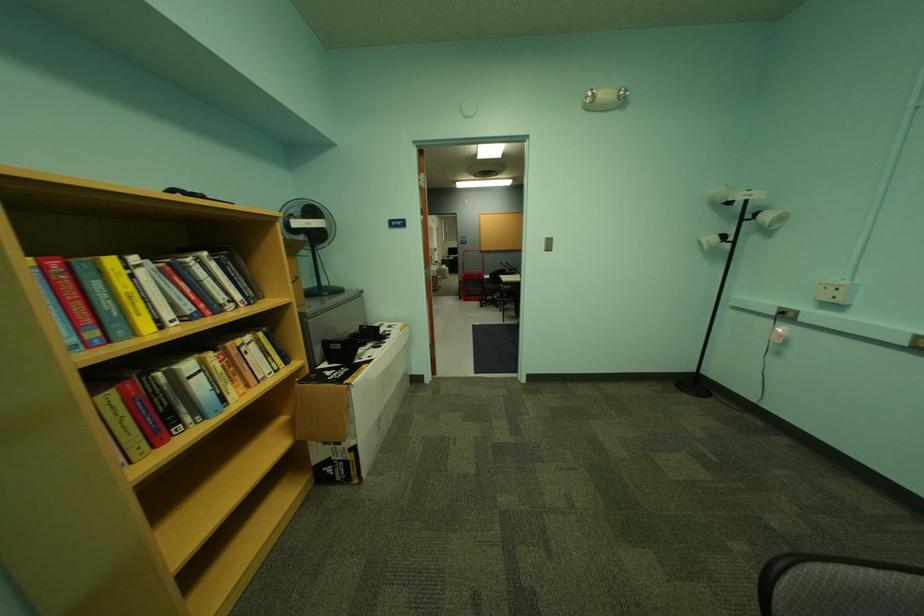
Where is `light switch`? Image resolution: width=924 pixels, height=616 pixels. light switch is located at coordinates (841, 293).